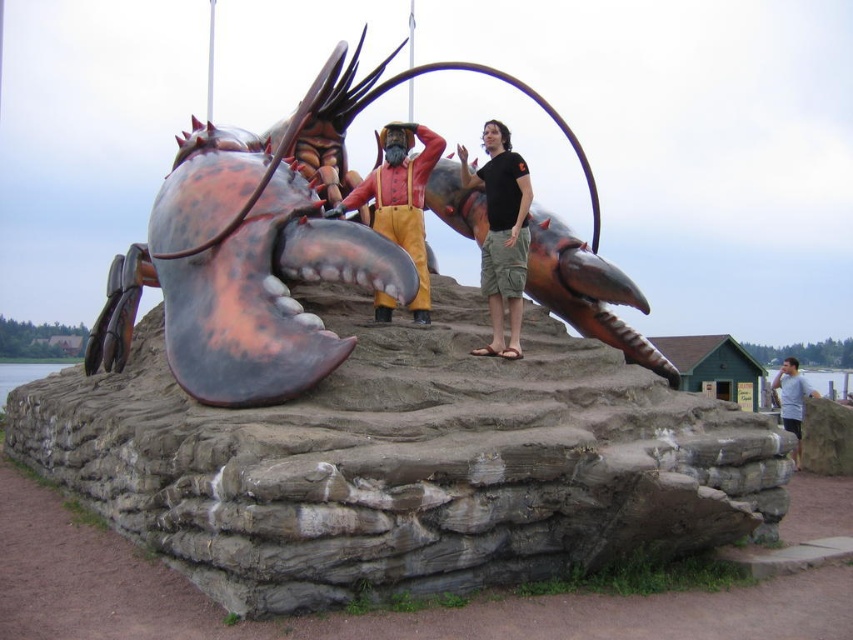
Measure the distance between point (364, 312) and camera.

The distance of point (364, 312) from camera is 214.46 feet.

The width and height of the screenshot is (853, 640). I want to click on rustic stone base at center, so click(x=405, y=464).

How far apart are metallic lobster at center and gray cotton shirt at lower right?

metallic lobster at center and gray cotton shirt at lower right are 45.03 meters apart from each other.

Who is taller, metallic lobster at center or gray cotton shirt at lower right?

metallic lobster at center is taller.

Which is in front, point (199, 182) or point (798, 401)?

Positioned in front is point (199, 182).

Where is `metallic lobster at center`? This screenshot has height=640, width=853. metallic lobster at center is located at coordinates (306, 256).

Looking at this image, is black cotton shirt at center bigger than reddish-brown leather boots at center?

Actually, black cotton shirt at center might be smaller than reddish-brown leather boots at center.

Find the location of a particular element. Image resolution: width=853 pixels, height=640 pixels. black cotton shirt at center is located at coordinates (502, 234).

Who is more distant from viewer, [512,182] or [413,131]?

The point [413,131] is behind.

Identify the location of black cotton shirt at center. The width and height of the screenshot is (853, 640). click(x=502, y=234).